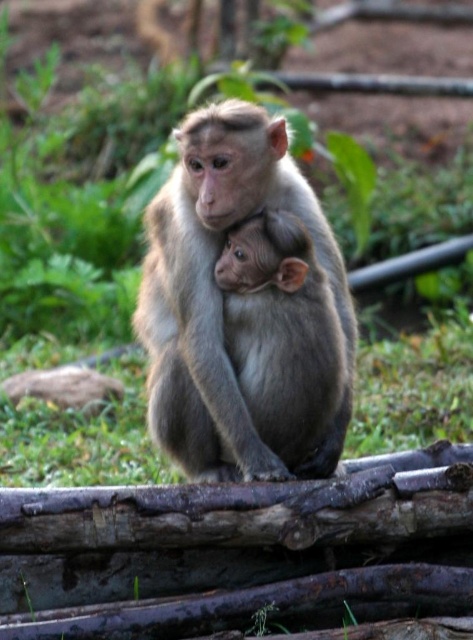
Question: Is light brown fur monkey at center wider than gray furry monkey at center?

Choices:
 (A) no
 (B) yes

Answer: (B)

Question: Is light brown fur monkey at center positioned before gray furry monkey at center?

Choices:
 (A) no
 (B) yes

Answer: (B)

Question: Is light brown fur monkey at center to the right of gray furry monkey at center from the viewer's perspective?

Choices:
 (A) yes
 (B) no

Answer: (B)

Question: Which object appears closest to the camera in this image?

Choices:
 (A) gray furry monkey at center
 (B) light brown fur monkey at center

Answer: (B)

Question: Which point appears farthest from the camera in this image?

Choices:
 (A) (184, 294)
 (B) (290, 464)

Answer: (B)

Question: Among these points, which one is farthest from the camera?

Choices:
 (A) (326, 468)
 (B) (324, 298)

Answer: (A)